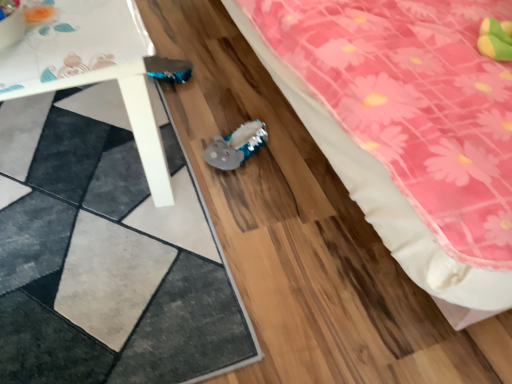
Question: Is textured gray rug at lower left inside the boundaries of white plastic table at lower left, or outside?

Choices:
 (A) inside
 (B) outside

Answer: (B)

Question: From a real-world perspective, is textured gray rug at lower left above or below white plastic table at lower left?

Choices:
 (A) above
 (B) below

Answer: (B)

Question: Based on their relative distances, which object is nearer to the pink fabric bed at lower right?

Choices:
 (A) fuzzy fabric plushie at center
 (B) white plastic table at lower left
 (C) textured gray rug at lower left

Answer: (A)

Question: Which of these objects is positioned closest to the pink fabric bed at lower right?

Choices:
 (A) textured gray rug at lower left
 (B) white plastic table at lower left
 (C) fuzzy fabric plushie at center

Answer: (C)